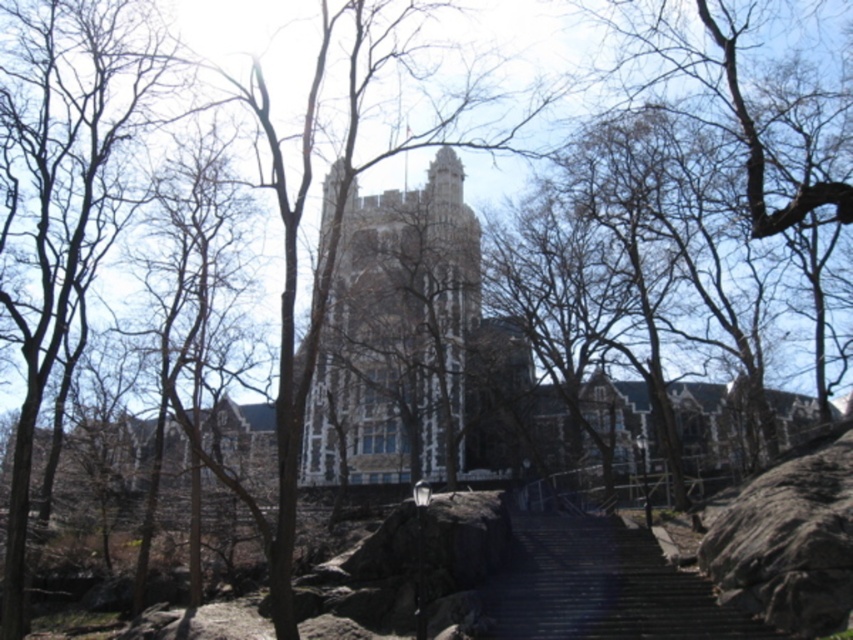
Who is positioned more to the left, dark gray concrete stairs at center or dark gray rough rock at lower right?

Positioned to the left is dark gray concrete stairs at center.

Does point (583, 588) come farther from viewer compared to point (759, 492)?

That is False.

Where is `dark gray concrete stairs at center`? The height and width of the screenshot is (640, 853). dark gray concrete stairs at center is located at coordinates (601, 588).

Which of these two, stone tower at center or dark gray rough rock at lower right, stands shorter?

Standing shorter between the two is dark gray rough rock at lower right.

Find the location of a particular element. This screenshot has width=853, height=640. stone tower at center is located at coordinates (395, 333).

Between point (460, 180) and point (602, 572), which one is positioned behind?

Positioned behind is point (460, 180).

Is the position of stone tower at center more distant than that of dark gray concrete stairs at center?

That is True.

Which is behind, point (444, 188) or point (502, 586)?

Point (444, 188)

At what (x,y) coordinates should I click in order to perform the action: click on stone tower at center. Please return your answer as a coordinate pair (x, y). Image resolution: width=853 pixels, height=640 pixels. Looking at the image, I should click on (395, 333).